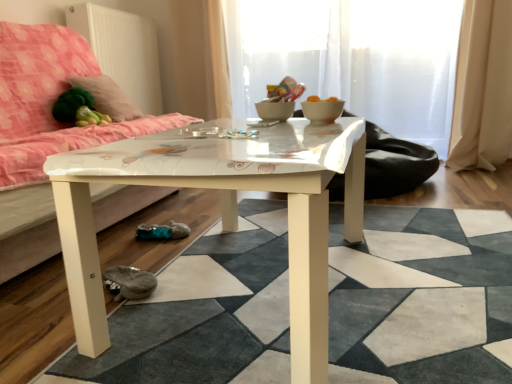
Locate an element on the screen. The height and width of the screenshot is (384, 512). free point to the right of gray suede shoe at lower left is located at coordinates (193, 286).